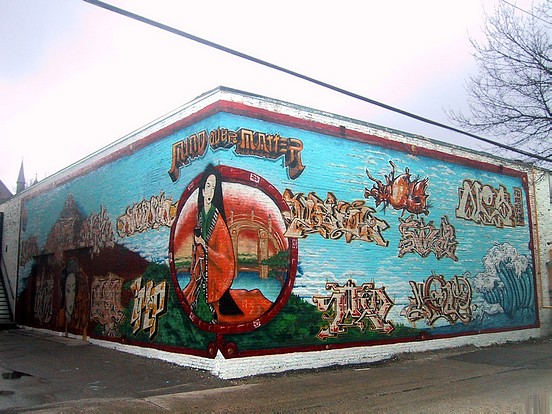
Locate an element on the screen. corner of the wall is located at coordinates (220, 95).